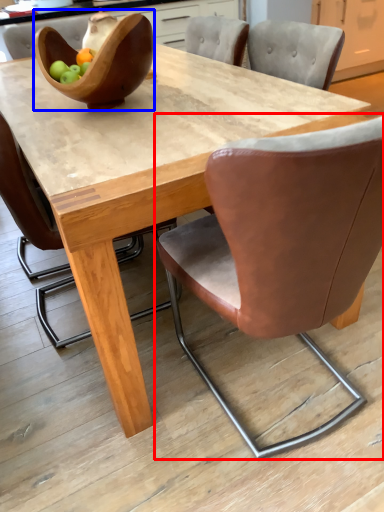
Question: Which object appears closest to the camera in this image, chair (highlighted by a red box) or bowl (highlighted by a blue box)?

Choices:
 (A) chair
 (B) bowl

Answer: (A)